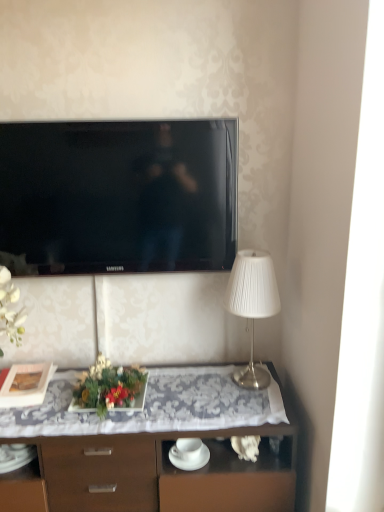
In order to face green leafy plant at center, should I rotate leftwards or rightwards?

You should look left and rotate roughly 10.862 degrees.

At what (x,y) coordinates should I click in order to perform the action: click on white pleated fabric lampshade at right. Please return your answer as a coordinate pair (x, y). Looking at the image, I should click on (252, 305).

In order to click on wooden desk at center in this screenshot , I will do pyautogui.click(x=158, y=447).

Is white pleated fabric lampshade at right next to matte black picture frame at left?

No, white pleated fabric lampshade at right is not making contact with matte black picture frame at left.

Is white pleated fabric lampshade at right at the left side of matte black picture frame at left?

No, white pleated fabric lampshade at right is not to the left of matte black picture frame at left.

Based on the photo, which object is closer to the camera taking this photo, white pleated fabric lampshade at right or matte black picture frame at left?

white pleated fabric lampshade at right is in front.

From a real-world perspective, is white pleated fabric lampshade at right physically located above or below matte black picture frame at left?

white pleated fabric lampshade at right is above matte black picture frame at left.

In the scene shown: Can green leafy plant at center be found inside white pleated fabric lampshade at right?

No, green leafy plant at center is not a part of white pleated fabric lampshade at right.

Does white pleated fabric lampshade at right have a greater width compared to green leafy plant at center?

Incorrect, the width of white pleated fabric lampshade at right does not surpass that of green leafy plant at center.

The image size is (384, 512). I want to click on floral arrangement in front of the white pleated fabric lampshade at right, so click(x=109, y=388).

Does point (260, 251) come behind point (138, 381)?

Yes, it is.

What's the angular difference between green leafy plant at center and black glossy tv at upper center's facing directions?

There is a 0.000139-degree angle between the facing directions of green leafy plant at center and black glossy tv at upper center.

From a real-world perspective, does green leafy plant at center sit lower than black glossy tv at upper center?

Correct, in the physical world, green leafy plant at center is lower than black glossy tv at upper center.

Based on their positions, is green leafy plant at center located to the left or right of black glossy tv at upper center?

Clearly, green leafy plant at center is on the left of black glossy tv at upper center in the image.

Considering the relative sizes of green leafy plant at center and black glossy tv at upper center in the image provided, is green leafy plant at center smaller than black glossy tv at upper center?

Indeed, green leafy plant at center has a smaller size compared to black glossy tv at upper center.

Would you say wooden desk at center is inside or outside white pleated fabric lampshade at right?

wooden desk at center is located beyond the bounds of white pleated fabric lampshade at right.

From the image's perspective, which one is positioned lower, wooden desk at center or white pleated fabric lampshade at right?

wooden desk at center.

Are wooden desk at center and white pleated fabric lampshade at right making contact?

No, wooden desk at center is not making contact with white pleated fabric lampshade at right.

From the image's perspective, which is above, green leafy plant at center or matte black picture frame at left?

green leafy plant at center is shown above in the image.

Considering the relative positions of green leafy plant at center and matte black picture frame at left in the image provided, is green leafy plant at center to the left of matte black picture frame at left from the viewer's perspective?

No, green leafy plant at center is not to the left of matte black picture frame at left.

Consider the image. Is green leafy plant at center positioned before matte black picture frame at left?

Yes.

From the image's perspective, is wooden desk at center beneath black glossy tv at upper center?

Correct, wooden desk at center appears lower than black glossy tv at upper center in the image.

Is wooden desk at center beside black glossy tv at upper center?

No, wooden desk at center is not next to black glossy tv at upper center.

Is wooden desk at center turned away from black glossy tv at upper center?

wooden desk at center does not have its back to black glossy tv at upper center.

From the image's perspective, is white pleated fabric lampshade at right above or below black glossy tv at upper center?

From the image's perspective, white pleated fabric lampshade at right appears below black glossy tv at upper center.

Is white pleated fabric lampshade at right positioned with its back to black glossy tv at upper center?

No, black glossy tv at upper center is not at the back of white pleated fabric lampshade at right.

Is point (250, 308) positioned behind point (125, 158)?

No, it is not.

Identify the location of lamp above the matte black picture frame at left (from a real-world perspective). (252, 305).

Locate an element on the screen. This screenshot has width=384, height=512. lamp behind the green leafy plant at center is located at coordinates (252, 305).

Looking at the image, which one is located closer to wooden desk at center, black glossy tv at upper center or matte black picture frame at left?

Among the two, matte black picture frame at left is located nearer to wooden desk at center.

Based on their spatial positions, is green leafy plant at center or black glossy tv at upper center closer to wooden desk at center?

The object closer to wooden desk at center is green leafy plant at center.

Looking at the image, which one is located further to matte black picture frame at left, wooden desk at center or white pleated fabric lampshade at right?

Based on the image, white pleated fabric lampshade at right appears to be further to matte black picture frame at left.

Estimate the real-world distances between objects in this image. Which object is further from matte black picture frame at left, green leafy plant at center or wooden desk at center?

wooden desk at center is further to matte black picture frame at left.

From the picture: From the image, which object appears to be nearer to matte black picture frame at left, wooden desk at center or green leafy plant at center?

Based on the image, green leafy plant at center appears to be nearer to matte black picture frame at left.

When comparing their distances from green leafy plant at center, does black glossy tv at upper center or white pleated fabric lampshade at right seem closer?

white pleated fabric lampshade at right.

Estimate the real-world distances between objects in this image. Which object is further from wooden desk at center, matte black picture frame at left or green leafy plant at center?

The object further to wooden desk at center is matte black picture frame at left.

When comparing their distances from white pleated fabric lampshade at right, does green leafy plant at center or matte black picture frame at left seem closer?

green leafy plant at center is positioned closer to the anchor white pleated fabric lampshade at right.

You are a GUI agent. You are given a task and a screenshot of the screen. Output one action in this format:
    pyautogui.click(x=<x>, y=<y>)
    Task: Click on the desk between matte black picture frame at left and white pleated fabric lampshade at right
    
    Given the screenshot: What is the action you would take?
    pyautogui.click(x=158, y=447)

Identify the location of lamp between black glossy tv at upper center and wooden desk at center in the up-down direction. (252, 305).

The width and height of the screenshot is (384, 512). In order to click on picture frame that lies between black glossy tv at upper center and wooden desk at center from top to bottom in this screenshot , I will do `click(28, 389)`.

What are the coordinates of `floral arrangement between black glossy tv at upper center and matte black picture frame at left in the up-down direction` in the screenshot? It's located at (109, 388).